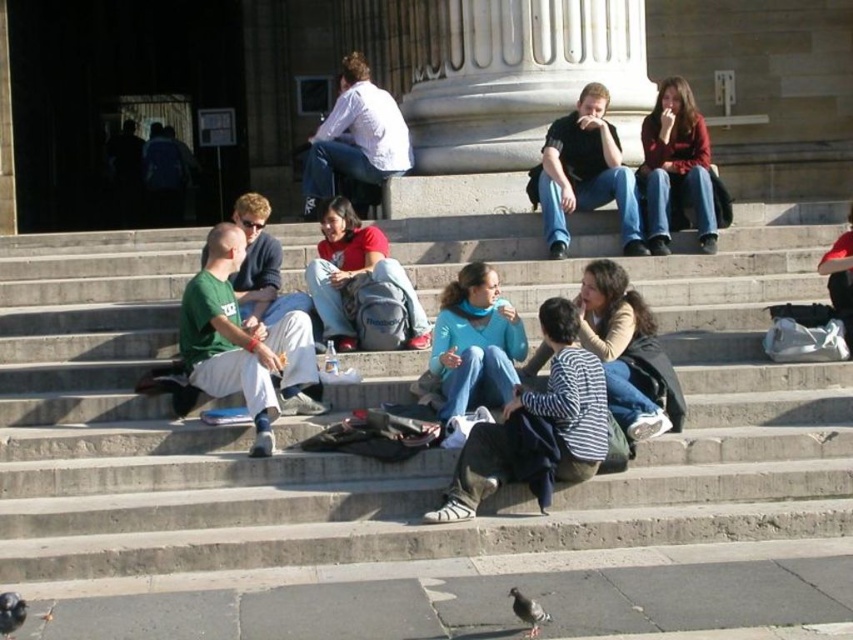
Question: Which object is farther from the camera taking this photo?

Choices:
 (A) gray matte pigeon at lower left
 (B) concrete stairs at center

Answer: (B)

Question: Which object is positioned farthest from the gray matte pigeon at lower center?

Choices:
 (A) black cotton shirt at center
 (B) gray matte pigeon at lower left

Answer: (A)

Question: Is gray matte pigeon at lower left thinner than gray matte pigeon at lower center?

Choices:
 (A) no
 (B) yes

Answer: (B)

Question: Is concrete stairs at center thinner than black cotton shirt at center?

Choices:
 (A) yes
 (B) no

Answer: (B)

Question: From the image, what is the correct spatial relationship of concrete stairs at center in relation to black cotton shirt at center?

Choices:
 (A) left
 (B) right

Answer: (A)

Question: Which of the following is the farthest from the observer?

Choices:
 (A) gray matte pigeon at lower center
 (B) gray matte pigeon at lower left
 (C) concrete stairs at center
 (D) black cotton shirt at center

Answer: (D)